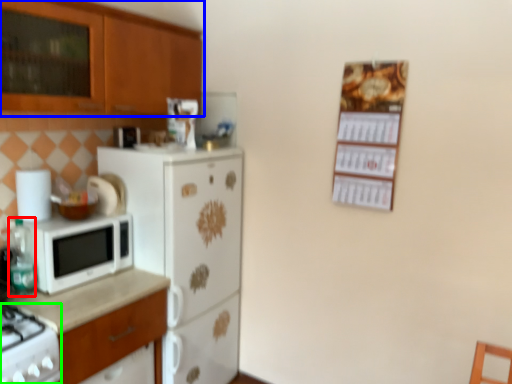
Question: Estimate the real-world distances between objects in this image. Which object is farther from bottle (highlighted by a red box), cabinetry (highlighted by a blue box) or gas stove (highlighted by a green box)?

Choices:
 (A) cabinetry
 (B) gas stove

Answer: (A)